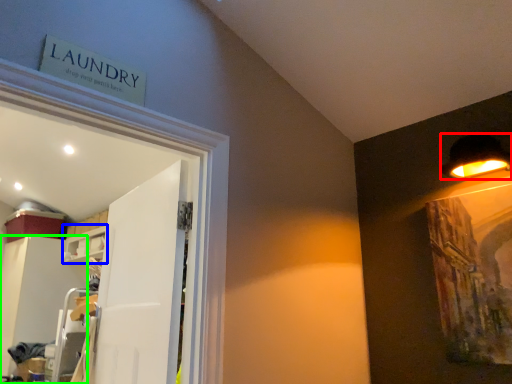
Question: Based on their relative distances, which object is nearer to lamp (highlighted by a red box)? Choose from shelf (highlighted by a blue box) and cabinetry (highlighted by a green box).

Choices:
 (A) shelf
 (B) cabinetry

Answer: (A)